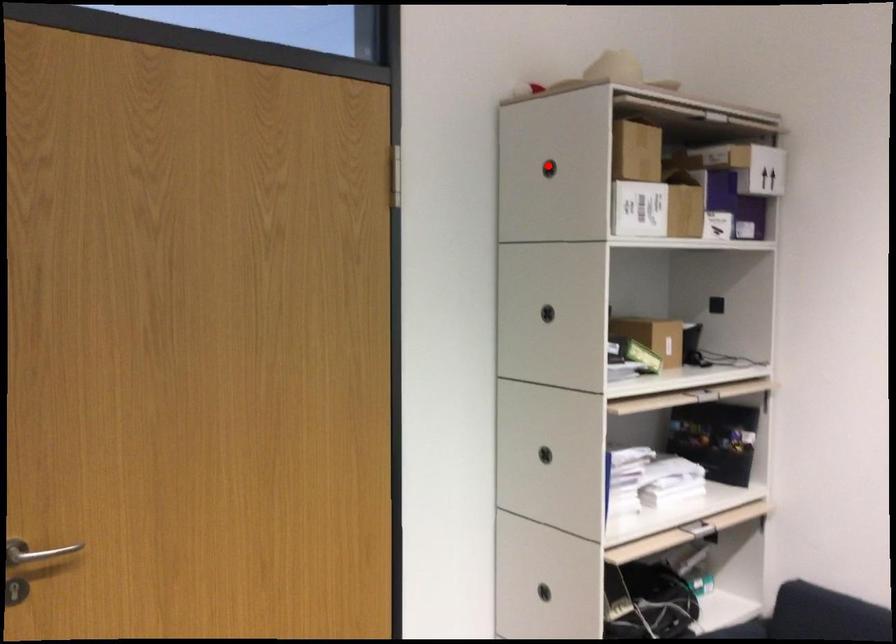
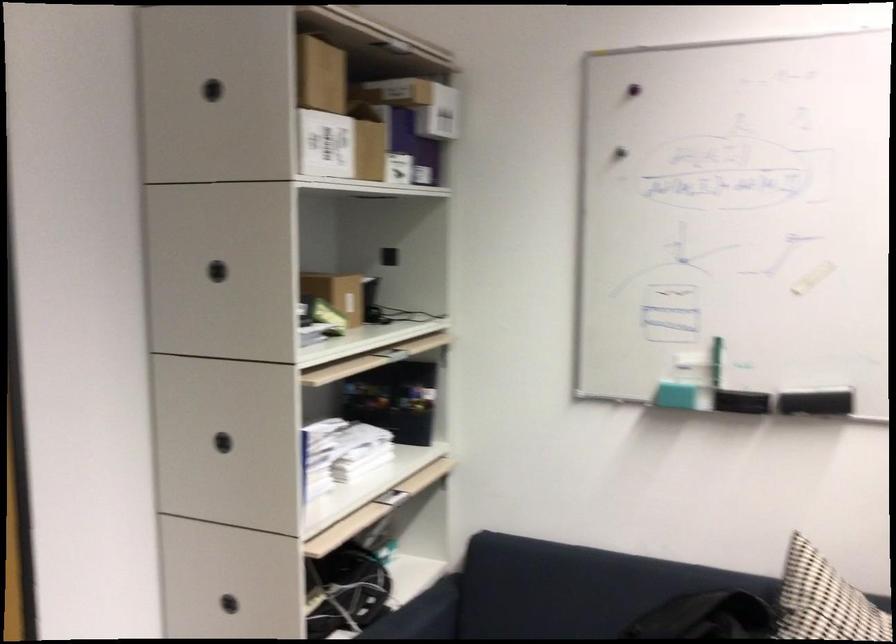
Locate, in the second image, the point that corresponds to the highlighted location in the first image.

(211, 90)